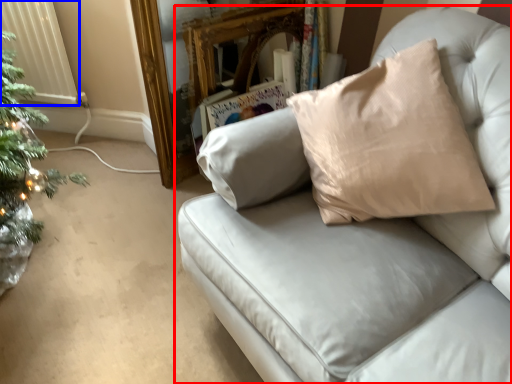
Question: Among these objects, which one is farthest to the camera, studio couch (highlighted by a red box) or radiator (highlighted by a blue box)?

Choices:
 (A) studio couch
 (B) radiator

Answer: (B)